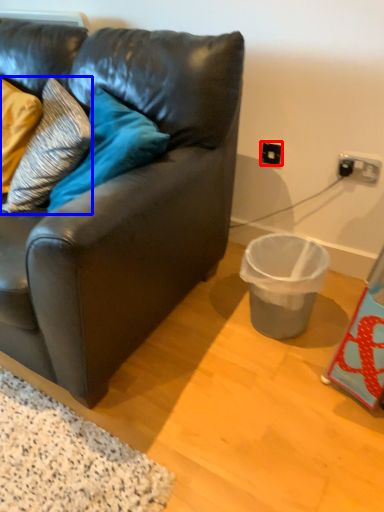
Question: Which of the following is the closest to the observer, electric outlet (highlighted by a red box) or pillow (highlighted by a blue box)?

Choices:
 (A) electric outlet
 (B) pillow

Answer: (B)